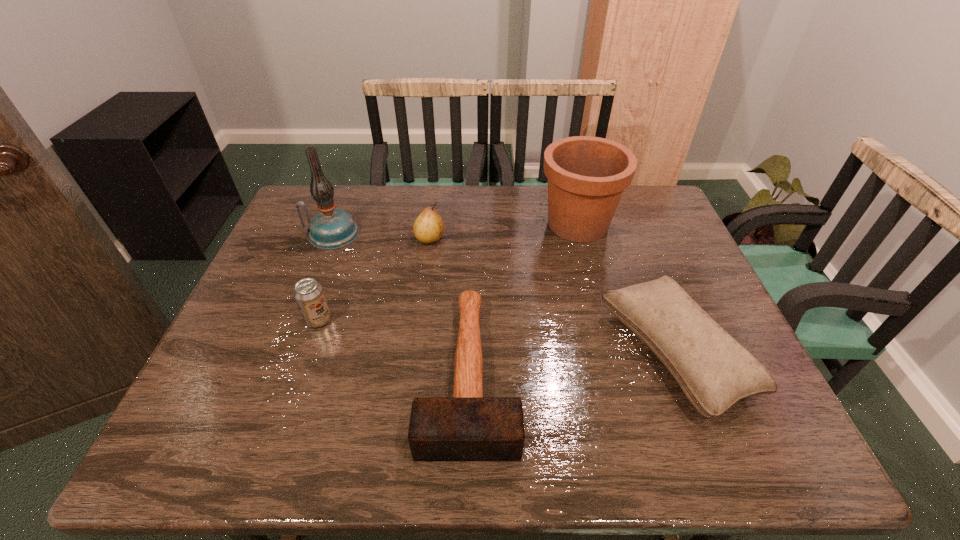
Find the location of a particular element. The width and height of the screenshot is (960, 540). unoccupied area between the pear and the flowerpot is located at coordinates (504, 231).

The width and height of the screenshot is (960, 540). What are the coordinates of `free space between the tallest object and the pear` in the screenshot? It's located at (381, 236).

Identify the location of vacant area that lies between the second tallest object and the shortest object. The image size is (960, 540). (523, 299).

Locate an element on the screen. The image size is (960, 540). empty location between the mallet and the fifth shortest object is located at coordinates (523, 299).

Where is `unoccupied position between the pear and the mallet`? This screenshot has height=540, width=960. unoccupied position between the pear and the mallet is located at coordinates (449, 306).

Point out which object is positioned as the nearest to the pear. Please provide its 2D coordinates. Your answer should be formatted as a tuple, i.e. [(x, y)], where the tuple contains the x and y coordinates of a point satisfying the conditions above.

[(331, 228)]

Where is `object that ranks as the fifth closest to the flowerpot`? object that ranks as the fifth closest to the flowerpot is located at coordinates (308, 293).

You are a GUI agent. You are given a task and a screenshot of the screen. Output one action in this format:
    pyautogui.click(x=<x>, y=<y>)
    Task: Click on the free space that satisfies the following two spatial constraints: 1. on the back side of the beer can; 2. on the right side of the pear
    This screenshot has height=540, width=960.
    Given the screenshot: What is the action you would take?
    pyautogui.click(x=347, y=239)

You are a GUI agent. You are given a task and a screenshot of the screen. Output one action in this format:
    pyautogui.click(x=<x>, y=<y>)
    Task: Click on the vacant region that satisfies the following two spatial constraints: 1. on the front side of the cushion; 2. on the left side of the beer can
    
    Given the screenshot: What is the action you would take?
    pyautogui.click(x=306, y=354)